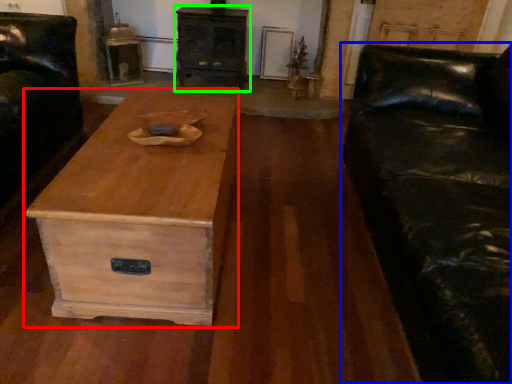
Question: Which object is the closest to the coffee table (highlighted by a red box)? Choose among these: studio couch (highlighted by a blue box) or chest of drawers (highlighted by a green box).

Choices:
 (A) studio couch
 (B) chest of drawers

Answer: (A)